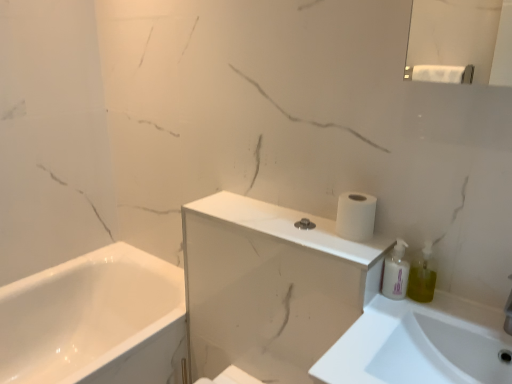
This screenshot has height=384, width=512. I want to click on free space in front of green translucent soap dispenser at right, so click(x=426, y=318).